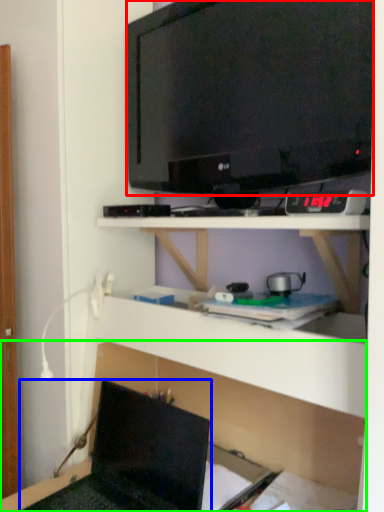
Question: Estimate the real-world distances between objects in this image. Which object is farther from television (highlighted by a red box), laptop (highlighted by a blue box) or shelf (highlighted by a green box)?

Choices:
 (A) laptop
 (B) shelf

Answer: (A)